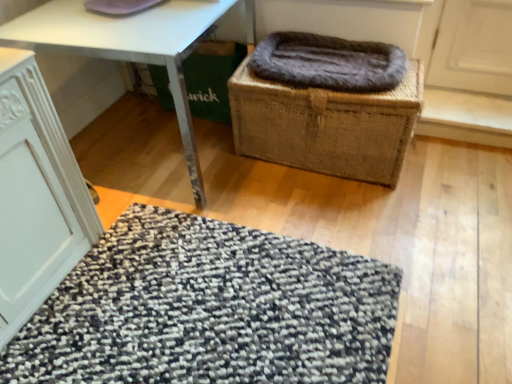
Question: Looking at the image, does woven brown basket at center seem bigger or smaller compared to textured gray mat at lower center?

Choices:
 (A) small
 (B) big

Answer: (B)

Question: Is woven brown basket at center in front of or behind textured gray mat at lower center in the image?

Choices:
 (A) front
 (B) behind

Answer: (B)

Question: Which of these objects is positioned closest to the fuzzy brown blanket at center?

Choices:
 (A) textured gray mat at lower center
 (B) white glossy table at center
 (C) woven brown basket at center
 (D) white matte cabinet at lower left

Answer: (C)

Question: Estimate the real-world distances between objects in this image. Which object is farther from the white matte cabinet at lower left?

Choices:
 (A) textured gray mat at lower center
 (B) woven brown basket at center
 (C) white glossy table at center
 (D) fuzzy brown blanket at center

Answer: (D)